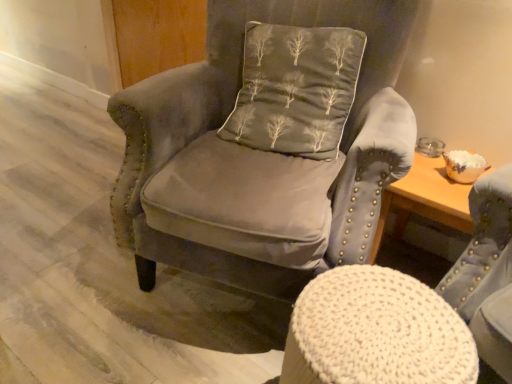
Question: In which direction should I rotate to look at velvet gray armchair at center, which is the first chair in top-to-bottom order?

Choices:
 (A) left
 (B) right

Answer: (B)

Question: Considering the relative sizes of dark gray fabric pillow with tree pattern at center and knitted fabric stool at center, which is the 1th chair from bottom to top, in the image provided, is dark gray fabric pillow with tree pattern at center smaller than knitted fabric stool at center, which is the 1th chair from bottom to top,?

Choices:
 (A) no
 (B) yes

Answer: (A)

Question: From the image's perspective, is dark gray fabric pillow with tree pattern at center located beneath knitted fabric stool at center, which is the 1th chair from bottom to top?

Choices:
 (A) no
 (B) yes

Answer: (A)

Question: Considering the relative sizes of dark gray fabric pillow with tree pattern at center and knitted fabric stool at center, which ranks as the 2th chair in top-to-bottom order, in the image provided, is dark gray fabric pillow with tree pattern at center thinner than knitted fabric stool at center, which ranks as the 2th chair in top-to-bottom order,?

Choices:
 (A) yes
 (B) no

Answer: (A)

Question: Does dark gray fabric pillow with tree pattern at center come behind knitted fabric stool at center, which is the 1th chair from bottom to top?

Choices:
 (A) yes
 (B) no

Answer: (A)

Question: Is dark gray fabric pillow with tree pattern at center bigger than knitted fabric stool at center, which is the 1th chair from bottom to top?

Choices:
 (A) yes
 (B) no

Answer: (A)

Question: Can we say dark gray fabric pillow with tree pattern at center lies outside knitted fabric stool at center, which is the 1th chair from bottom to top?

Choices:
 (A) no
 (B) yes

Answer: (B)

Question: Can you confirm if knitted fabric stool at center, which is the 1th chair from bottom to top, is shorter than dark gray fabric pillow with tree pattern at center?

Choices:
 (A) yes
 (B) no

Answer: (A)

Question: Is knitted fabric stool at center, which is the 1th chair from bottom to top, aimed at dark gray fabric pillow with tree pattern at center?

Choices:
 (A) yes
 (B) no

Answer: (B)

Question: Is dark gray fabric pillow with tree pattern at center located within knitted fabric stool at center, which ranks as the 2th chair in top-to-bottom order?

Choices:
 (A) no
 (B) yes

Answer: (A)

Question: Does knitted fabric stool at center, which is the 1th chair from bottom to top, have a smaller size compared to dark gray fabric pillow with tree pattern at center?

Choices:
 (A) yes
 (B) no

Answer: (A)

Question: Can you confirm if knitted fabric stool at center, which is the 1th chair from bottom to top, is taller than dark gray fabric pillow with tree pattern at center?

Choices:
 (A) yes
 (B) no

Answer: (B)

Question: Considering the relative sizes of knitted fabric stool at center, which is the 1th chair from bottom to top, and dark gray fabric pillow with tree pattern at center in the image provided, is knitted fabric stool at center, which is the 1th chair from bottom to top, wider than dark gray fabric pillow with tree pattern at center?

Choices:
 (A) no
 (B) yes

Answer: (B)

Question: Does velvet gray armchair at center, which is the first chair in top-to-bottom order, have a larger size compared to knitted fabric stool at center, which is the 1th chair from bottom to top?

Choices:
 (A) yes
 (B) no

Answer: (A)